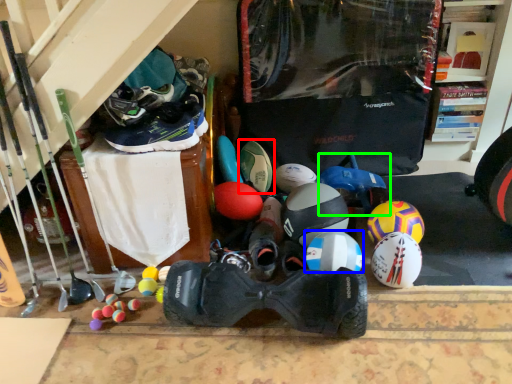
Question: Considering the real-world distances, which object is closest to footwear (highlighted by a red box)? helmet (highlighted by a blue box) or toy (highlighted by a green box).

Choices:
 (A) helmet
 (B) toy

Answer: (B)